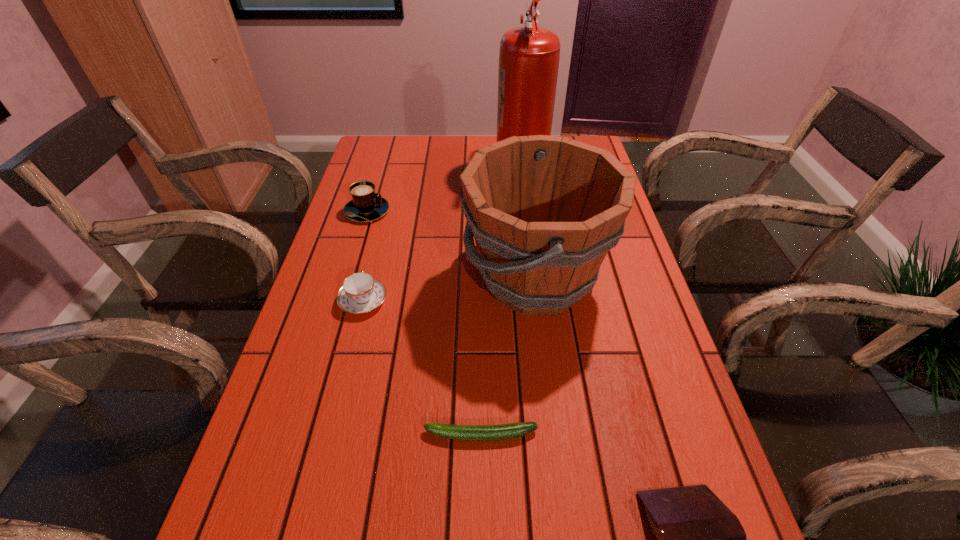
Identify the location of vacant area situated 0.190m on the front-facing side of the second nearest object. 321,435.

Locate an element on the screen. This screenshot has height=540, width=960. object located in the far edge section of the desktop is located at coordinates (529, 56).

Find the location of a particular element. The height and width of the screenshot is (540, 960). cappuccino located in the left edge section of the desktop is located at coordinates (366, 205).

The width and height of the screenshot is (960, 540). In order to click on teacup positioned at the left edge in this screenshot , I will do click(x=360, y=293).

Locate an element on the screen. The width and height of the screenshot is (960, 540). object that is at the right edge is located at coordinates (544, 210).

Where is `vacant region at the far edge of the desktop`? vacant region at the far edge of the desktop is located at coordinates (445, 148).

In the image, there is a desktop. Where is `vacant space at the left edge`? The height and width of the screenshot is (540, 960). vacant space at the left edge is located at coordinates (296, 485).

Where is `vacant space at the right edge of the desktop`? vacant space at the right edge of the desktop is located at coordinates (636, 321).

Locate an element on the screen. The width and height of the screenshot is (960, 540). blank region between the cappuccino and the teacup is located at coordinates click(x=365, y=256).

You are a GUI agent. You are given a task and a screenshot of the screen. Output one action in this format:
    pyautogui.click(x=<x>, y=<y>)
    Task: Click on the vacant area that lies between the teacup and the farthest object
    This screenshot has height=540, width=960.
    Given the screenshot: What is the action you would take?
    pyautogui.click(x=442, y=233)